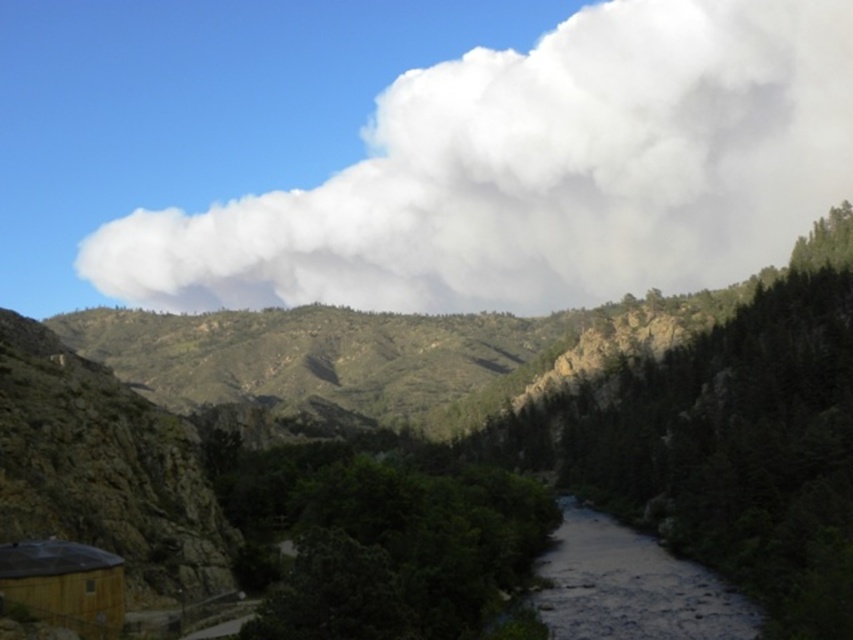
You are a hiker who wants to reach the brown wooden hut at lower left from the dark gray smooth river at center. Which direction should you move relative to the river?

The brown wooden hut at lower left is behind the dark gray smooth river at center, so you should move in the direction away from the river to reach it.